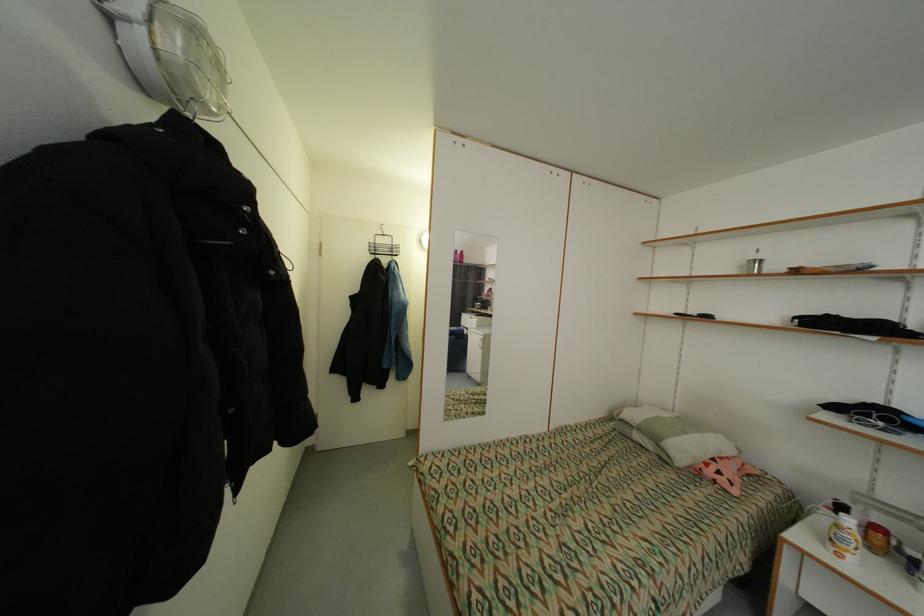
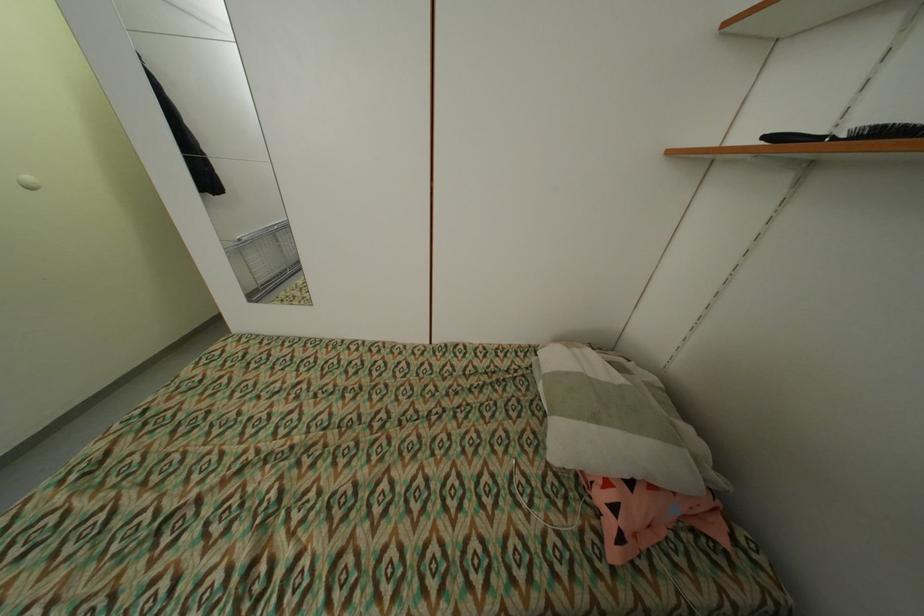
Find the pixel in the second image that matches (715,474) in the first image.

(606, 498)